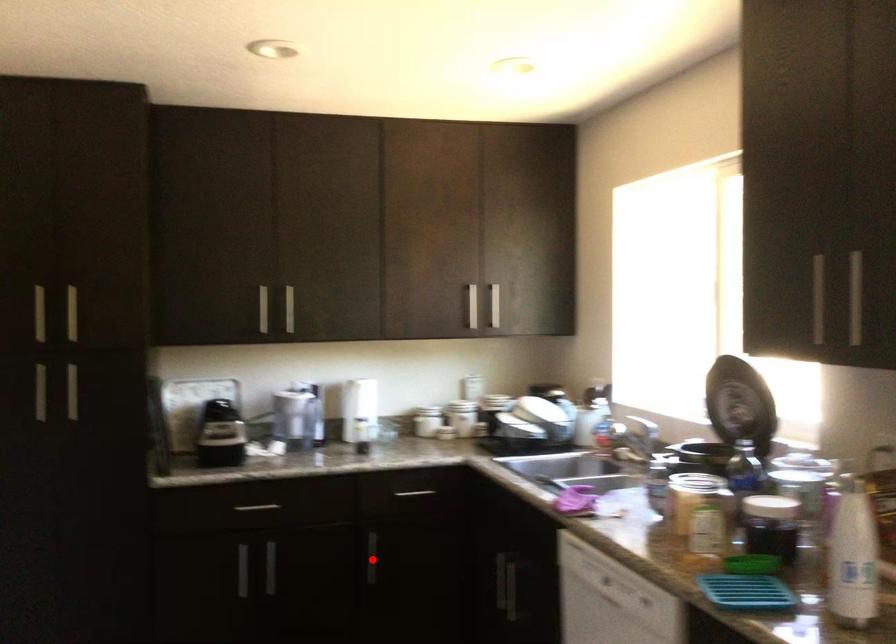
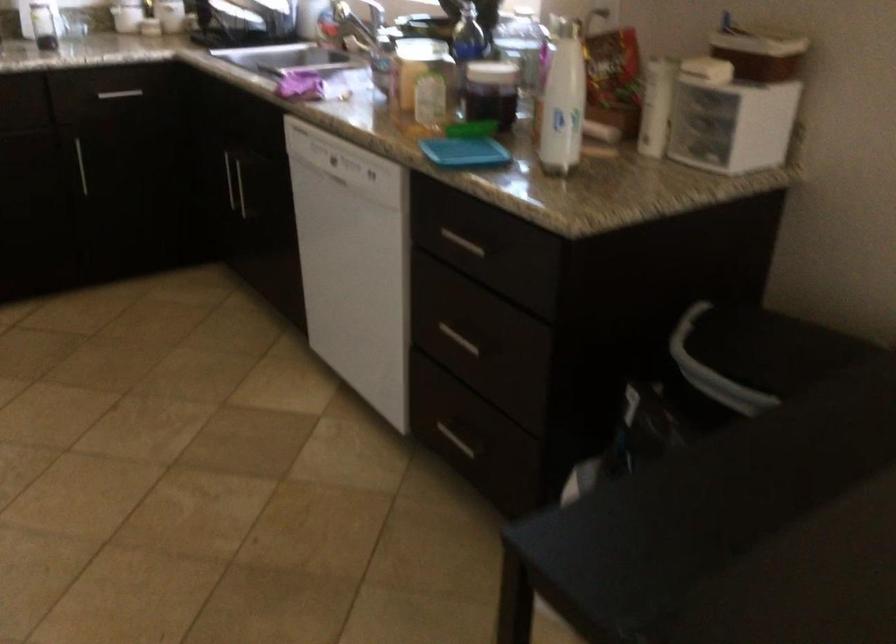
Question: I am providing you with two images of the same scene from different viewpoints. In image1, a red point is highlighted. Considering the same 3D point in image2, which of the following is correct?

Choices:
 (A) It is closer
 (B) It is farther

Answer: (A)